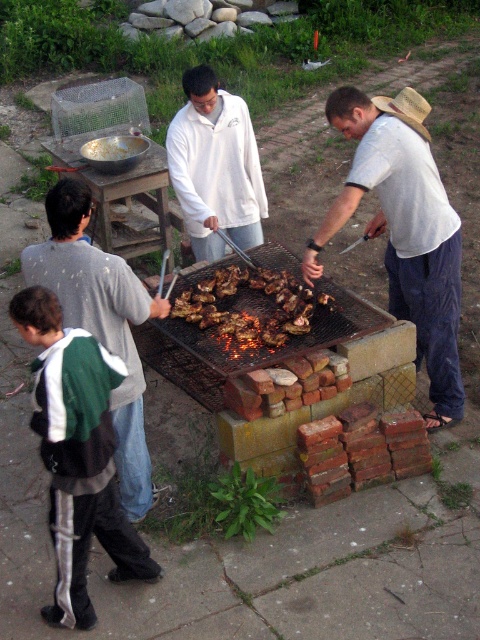
In the scene shown: You are standing at the origin point of the coordinate system, which is the bottom left corner of the image. You want to place a new object at the same location as the green and white fleece jacket at lower left. What coordinates should you use?

The coordinates for the green and white fleece jacket at lower left are at point (78, 454), so you should place the new object at coordinates (78, 454).

You are a photographer trying to capture a photo of the grilled meat at center without any obstructions. Considering the green and white fleece jacket at lower left, will you need to adjust your camera angle to avoid it appearing in the shot?

The green and white fleece jacket at lower left is much taller than the grilled meat at center, so adjusting the camera angle is necessary to avoid it obstructing the view of the grilled meat at center.